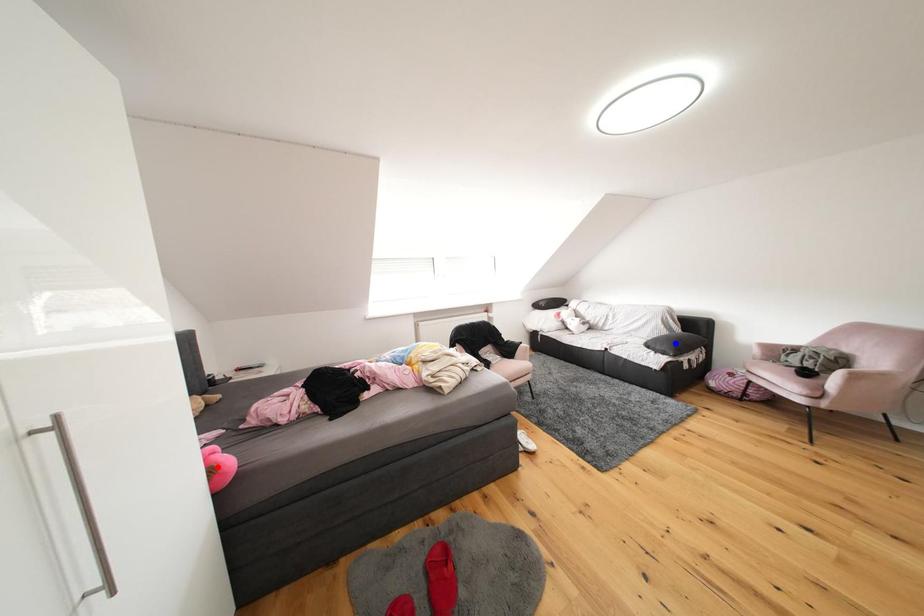
Question: Which of the two points in the image is closer to the camera?

Choices:
 (A) Blue point is closer.
 (B) Red point is closer.

Answer: (B)